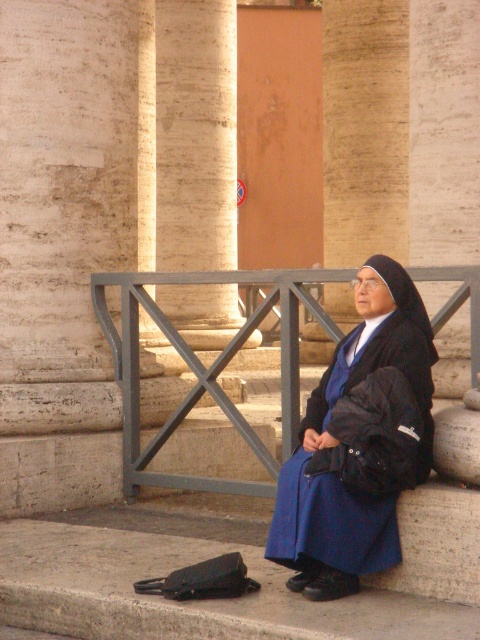
Question: Which point is farther to the camera?

Choices:
 (A) (181, 212)
 (B) (396, 534)

Answer: (A)

Question: Can you confirm if metallic gray rail at center is positioned below blue fabric nun at center?

Choices:
 (A) yes
 (B) no

Answer: (B)

Question: Among these points, which one is nearest to the camera?

Choices:
 (A) [x=215, y=129]
 (B) [x=242, y=493]
 (C) [x=338, y=177]

Answer: (B)

Question: Does white marble pillar at center appear on the right side of metallic gray rail at center?

Choices:
 (A) no
 (B) yes

Answer: (A)

Question: Which of these objects is positioned closest to the smooth stone pillar at center?

Choices:
 (A) blue fabric nun at center
 (B) white marble pillar at center
 (C) metallic gray rail at center

Answer: (B)

Question: Observing the image, what is the correct spatial positioning of white marble pillar at center in reference to metallic gray rail at center?

Choices:
 (A) below
 (B) above

Answer: (B)